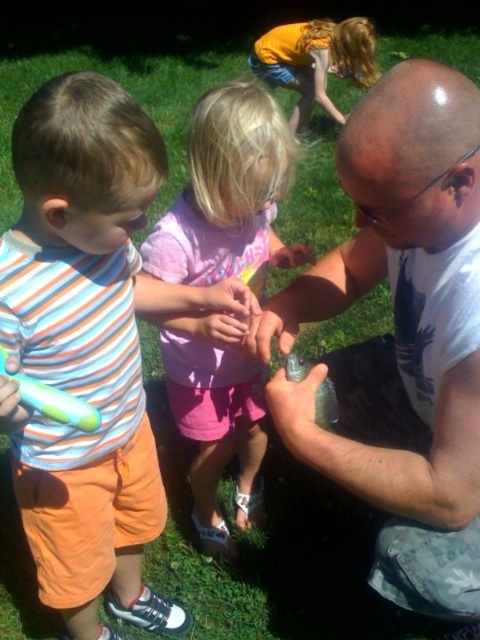
Question: Which point is closer to the camera taking this photo?

Choices:
 (A) (466, 602)
 (B) (94, 529)

Answer: (A)

Question: Is satin white shirt at center smaller than striped cotton shirt at center?

Choices:
 (A) no
 (B) yes

Answer: (B)

Question: Which point is farther to the camera?

Choices:
 (A) pink fabric dress at center
 (B) striped cotton shirt at center
 (C) satin white shirt at center

Answer: (A)

Question: Does satin white shirt at center come in front of pink fabric dress at center?

Choices:
 (A) no
 (B) yes

Answer: (B)

Question: Can you confirm if satin white shirt at center is bigger than striped cotton shirt at center?

Choices:
 (A) yes
 (B) no

Answer: (B)

Question: Which point is farther to the camera?

Choices:
 (A) striped cotton shirt at center
 (B) pink fabric dress at center
 (C) satin white shirt at center

Answer: (B)